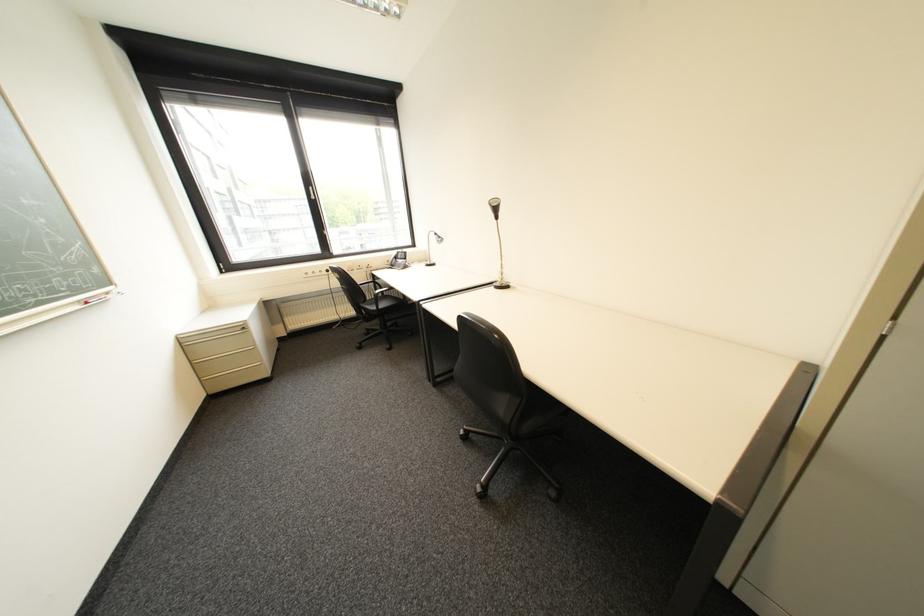
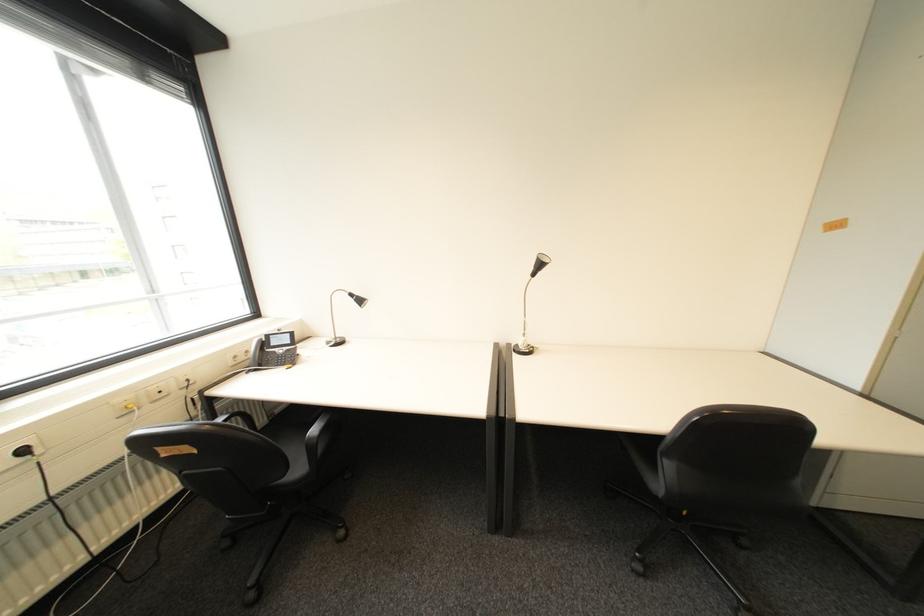
The point at (337,272) is marked in the first image. Where is the corresponding point in the second image?

(34, 452)